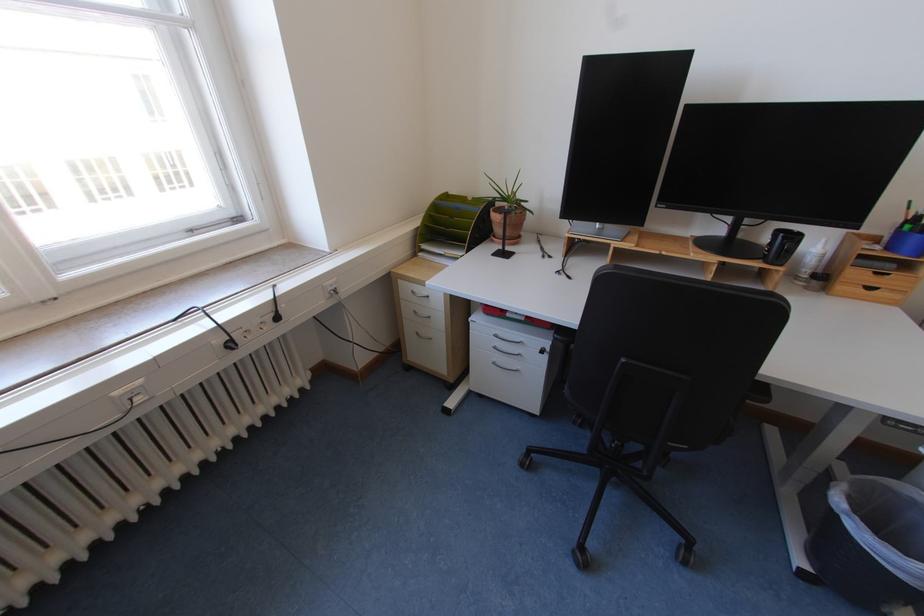
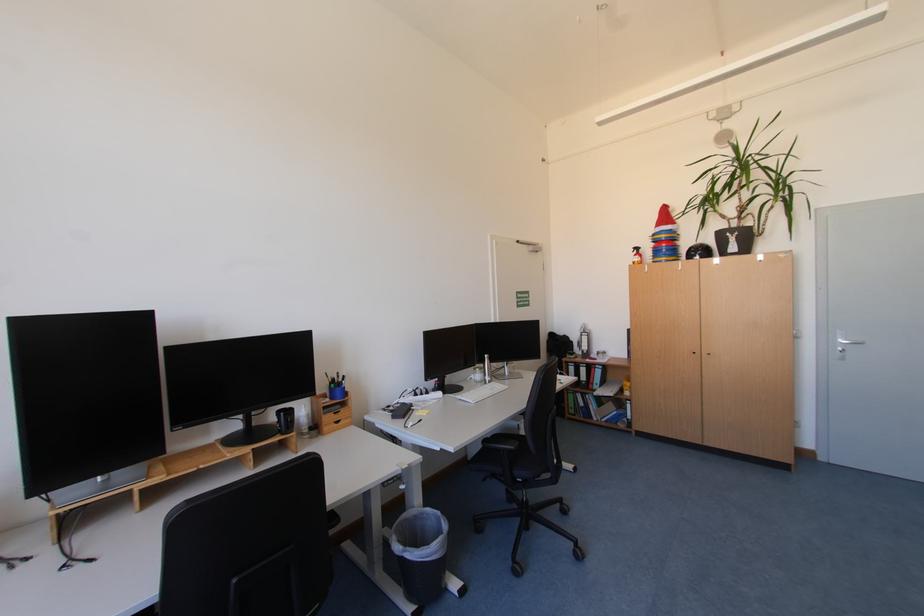
Find the pixel in the second image that matches point 772,233 in the first image.

(277, 416)